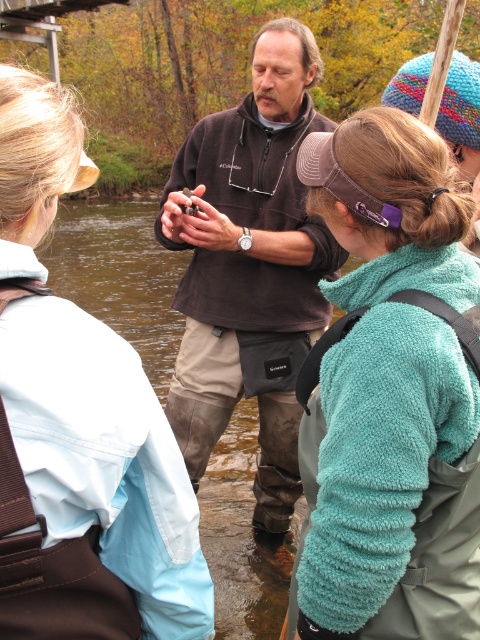
Question: Where is light blue waterproof jacket at upper left located in relation to brown soft sweater at center in the image?

Choices:
 (A) above
 (B) below

Answer: (B)

Question: Is teal fleece jacket at center closer to camera compared to light blue waterproof jacket at upper left?

Choices:
 (A) yes
 (B) no

Answer: (B)

Question: Which point is closer to the camera taking this photo?

Choices:
 (A) (310, 268)
 (B) (36, 355)

Answer: (B)

Question: Which of the following is the closest to the observer?

Choices:
 (A) (475, 378)
 (B) (108, 547)
 (C) (284, 416)

Answer: (B)

Question: Among these objects, which one is farthest from the camera?

Choices:
 (A) brown soft sweater at center
 (B) teal fleece jacket at center
 (C) light blue waterproof jacket at upper left

Answer: (A)

Question: Can you confirm if teal fleece jacket at center is positioned to the left of light blue waterproof jacket at upper left?

Choices:
 (A) yes
 (B) no

Answer: (B)